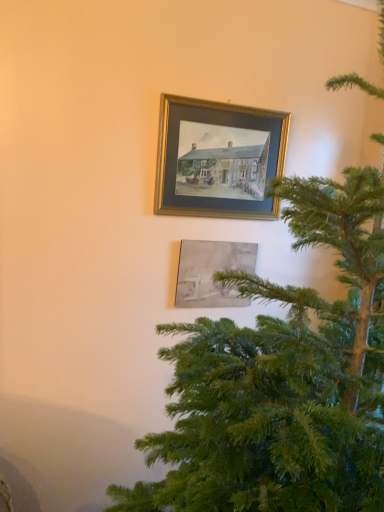
Question: Would you say gray matte painting at lower center, arranged as the 1th picture frame when ordered from the bottom, contains gold metallic picture frame at upper center, which is the 2th picture frame in bottom-to-top order?

Choices:
 (A) yes
 (B) no

Answer: (B)

Question: Is gray matte painting at lower center, arranged as the 1th picture frame when ordered from the bottom, outside of gold metallic picture frame at upper center, which is the 2th picture frame in bottom-to-top order?

Choices:
 (A) no
 (B) yes

Answer: (B)

Question: Is gray matte painting at lower center, arranged as the 1th picture frame when ordered from the bottom, wider than gold metallic picture frame at upper center, which is the 2th picture frame in bottom-to-top order?

Choices:
 (A) no
 (B) yes

Answer: (A)

Question: Is gray matte painting at lower center, arranged as the 1th picture frame when ordered from the bottom, oriented away from gold metallic picture frame at upper center, which is counted as the 1th picture frame, starting from the top?

Choices:
 (A) yes
 (B) no

Answer: (B)

Question: From a real-world perspective, is gray matte painting at lower center, arranged as the second picture frame when viewed from the top, positioned under gold metallic picture frame at upper center, which is counted as the 1th picture frame, starting from the top, based on gravity?

Choices:
 (A) yes
 (B) no

Answer: (A)

Question: Visually, is green textured christmas tree at right positioned to the left or to the right of gray matte painting at lower center, arranged as the second picture frame when viewed from the top?

Choices:
 (A) left
 (B) right

Answer: (B)

Question: Which is correct: green textured christmas tree at right is inside gray matte painting at lower center, arranged as the 1th picture frame when ordered from the bottom, or outside of it?

Choices:
 (A) inside
 (B) outside

Answer: (B)

Question: From the image's perspective, is green textured christmas tree at right located above or below gray matte painting at lower center, arranged as the 1th picture frame when ordered from the bottom?

Choices:
 (A) above
 (B) below

Answer: (B)

Question: Relative to gray matte painting at lower center, arranged as the 1th picture frame when ordered from the bottom, is green textured christmas tree at right in front or behind?

Choices:
 (A) behind
 (B) front

Answer: (B)

Question: In terms of height, does gray matte painting at lower center, arranged as the 1th picture frame when ordered from the bottom, look taller or shorter compared to green textured christmas tree at right?

Choices:
 (A) short
 (B) tall

Answer: (A)

Question: In the image, is gray matte painting at lower center, arranged as the 1th picture frame when ordered from the bottom, on the left side or the right side of green textured christmas tree at right?

Choices:
 (A) left
 (B) right

Answer: (A)

Question: Considering their positions, is gray matte painting at lower center, arranged as the second picture frame when viewed from the top, located in front of or behind green textured christmas tree at right?

Choices:
 (A) behind
 (B) front

Answer: (A)

Question: From the image's perspective, is gray matte painting at lower center, arranged as the second picture frame when viewed from the top, located above or below green textured christmas tree at right?

Choices:
 (A) below
 (B) above

Answer: (B)

Question: From a real-world perspective, is gold metallic picture frame at upper center, which is counted as the 1th picture frame, starting from the top, positioned above or below gray matte painting at lower center, arranged as the 1th picture frame when ordered from the bottom?

Choices:
 (A) below
 (B) above

Answer: (B)

Question: Is gold metallic picture frame at upper center, which is the 2th picture frame in bottom-to-top order, wider or thinner than gray matte painting at lower center, arranged as the second picture frame when viewed from the top?

Choices:
 (A) wide
 (B) thin

Answer: (A)